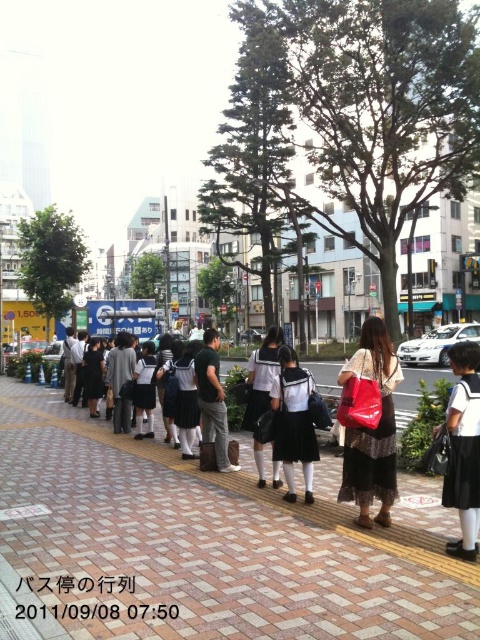
You are standing on the sidewalk and see the brick pavement at center and the matte black dress at center. Which object is positioned to the left?

The brick pavement at center is to the left of the matte black dress at center.